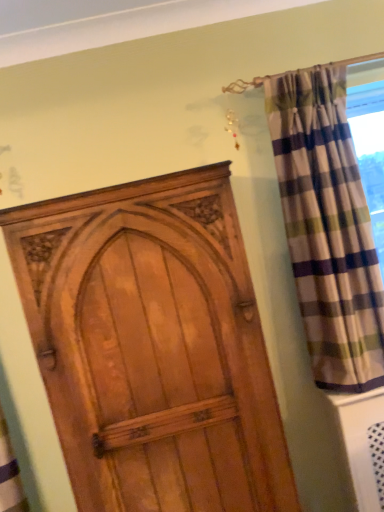
What is the approximate height of plaid fabric curtain at right?

plaid fabric curtain at right is 4.27 feet in height.

The image size is (384, 512). I want to click on plaid fabric curtain at right, so pos(327,227).

This screenshot has width=384, height=512. What do you see at coordinates (327, 227) in the screenshot?
I see `plaid fabric curtain at right` at bounding box center [327, 227].

I want to click on wooden door at center, so click(153, 346).

Image resolution: width=384 pixels, height=512 pixels. Describe the element at coordinates (153, 346) in the screenshot. I see `wooden door at center` at that location.

I want to click on plaid fabric curtain at right, so click(327, 227).

Is plaid fabric curtain at right at the left side of wooden door at center?

Incorrect, plaid fabric curtain at right is not on the left side of wooden door at center.

Considering the relative positions of plaid fabric curtain at right and wooden door at center in the image provided, is plaid fabric curtain at right in front of wooden door at center?

That is False.

Which point is more forward, (309, 348) or (76, 213)?

Point (76, 213)

From the image's perspective, which is below, plaid fabric curtain at right or wooden door at center?

wooden door at center, from the image's perspective.

From a real-world perspective, between plaid fabric curtain at right and wooden door at center, who is vertically higher?

plaid fabric curtain at right is physically above.

Considering the sizes of objects plaid fabric curtain at right and wooden door at center in the image provided, who is thinner, plaid fabric curtain at right or wooden door at center?

plaid fabric curtain at right is thinner.

Who is shorter, plaid fabric curtain at right or wooden door at center?

Standing shorter between the two is plaid fabric curtain at right.

Can you confirm if plaid fabric curtain at right is smaller than wooden door at center?

Yes, plaid fabric curtain at right is smaller than wooden door at center.

Is plaid fabric curtain at right situated inside wooden door at center or outside?

plaid fabric curtain at right is not enclosed by wooden door at center.

Are plaid fabric curtain at right and wooden door at center beside each other?

plaid fabric curtain at right and wooden door at center are not in contact.

From the picture: Could you tell me if plaid fabric curtain at right is turned towards wooden door at center?

No.

How different are the orientations of plaid fabric curtain at right and wooden door at center in degrees?

5.62 degrees separate the facing orientations of plaid fabric curtain at right and wooden door at center.

Measure the distance between plaid fabric curtain at right and wooden door at center.

They are 24.32 inches apart.

Where is `curtain behind the wooden door at center`? The width and height of the screenshot is (384, 512). curtain behind the wooden door at center is located at coordinates (327, 227).

Considering the positions of objects wooden door at center and plaid fabric curtain at right in the image provided, who is more to the right, wooden door at center or plaid fabric curtain at right?

plaid fabric curtain at right is more to the right.

Between wooden door at center and plaid fabric curtain at right, which one is positioned behind?

plaid fabric curtain at right is behind.

Does point (76, 443) appear closer or farther from the camera than point (351, 308)?

Point (76, 443) is positioned closer to the camera compared to point (351, 308).

From the image's perspective, is wooden door at center located above or below plaid fabric curtain at right?

Based on their image positions, wooden door at center is located beneath plaid fabric curtain at right.

From a real-world perspective, which object rests below the other?

wooden door at center.

Looking at this image, considering the sizes of objects wooden door at center and plaid fabric curtain at right in the image provided, who is wider, wooden door at center or plaid fabric curtain at right?

With larger width is wooden door at center.

Considering the sizes of objects wooden door at center and plaid fabric curtain at right in the image provided, who is taller, wooden door at center or plaid fabric curtain at right?

wooden door at center.

Who is smaller, wooden door at center or plaid fabric curtain at right?

plaid fabric curtain at right.

Is wooden door at center situated inside plaid fabric curtain at right or outside?

wooden door at center is located beyond the bounds of plaid fabric curtain at right.

Is wooden door at center far from plaid fabric curtain at right?

That's not correct — wooden door at center is a little close to plaid fabric curtain at right.

Does wooden door at center turn towards plaid fabric curtain at right?

No, wooden door at center is not facing towards plaid fabric curtain at right.

The image size is (384, 512). I want to click on door that is on the left side of plaid fabric curtain at right, so click(153, 346).

Find the location of a particular element. curtain above the wooden door at center (from the image's perspective) is located at coordinates (327, 227).

Find the location of `door below the plaid fabric curtain at right (from a real-world perspective)`. door below the plaid fabric curtain at right (from a real-world perspective) is located at coordinates (153, 346).